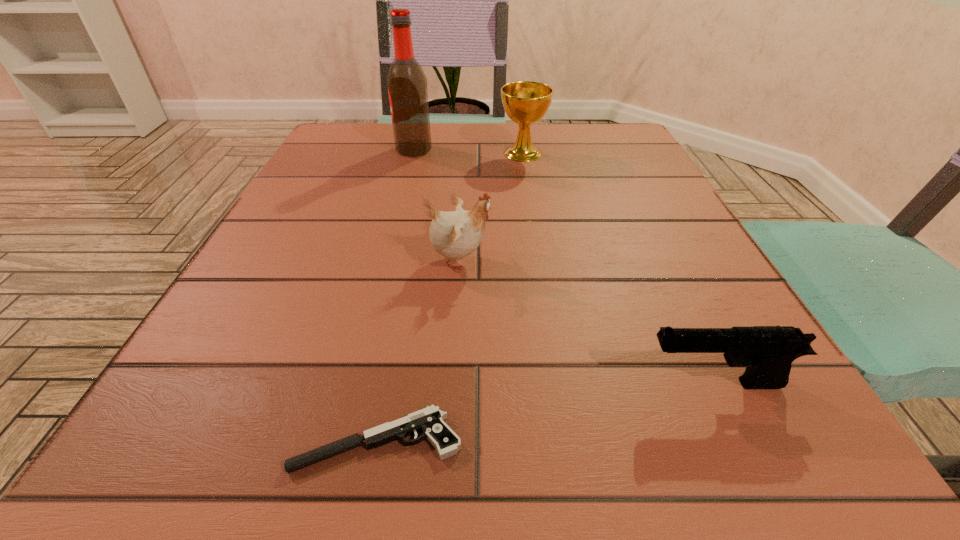
At what (x,y) coordinates should I click in order to perform the action: click on free space that satisfies the following two spatial constraints: 1. on the front side of the chalice; 2. at the beak of the third nearest object. Please return your answer as a coordinate pair (x, y). This screenshot has height=540, width=960. Looking at the image, I should click on (540, 261).

Find the location of a particular element. The image size is (960, 540). vacant space that satisfies the following two spatial constraints: 1. on the front side of the chalice; 2. at the beak of the bird is located at coordinates (540, 261).